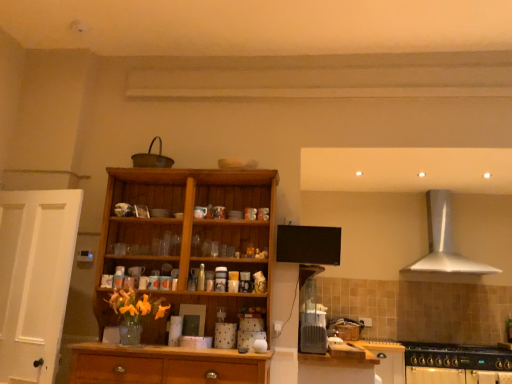
Question: Would you say wooden cabinet at center is outside wooden cabinet at lower center, positioned as the 1th cabinetry in front-to-back order?

Choices:
 (A) no
 (B) yes

Answer: (B)

Question: Considering the relative sizes of wooden cabinet at center and wooden cabinet at lower center, the 2th cabinetry from the back, in the image provided, is wooden cabinet at center smaller than wooden cabinet at lower center, the 2th cabinetry from the back,?

Choices:
 (A) yes
 (B) no

Answer: (B)

Question: Does wooden cabinet at center contain wooden cabinet at lower center, the 2th cabinetry from the back?

Choices:
 (A) no
 (B) yes

Answer: (A)

Question: Can you confirm if wooden cabinet at center is taller than wooden cabinet at lower center, the 1th cabinetry when ordered from left to right?

Choices:
 (A) yes
 (B) no

Answer: (A)

Question: From a real-world perspective, is wooden cabinet at center on top of wooden cabinet at lower center, the 1th cabinetry when ordered from left to right?

Choices:
 (A) yes
 (B) no

Answer: (A)

Question: Does wooden cabinet at center have a greater width compared to wooden cabinet at lower center, the 2th cabinetry from the back?

Choices:
 (A) yes
 (B) no

Answer: (B)

Question: Is black matte gas stove at lower right far away from wooden cabinet at lower center, the 2th cabinetry from the back?

Choices:
 (A) no
 (B) yes

Answer: (B)

Question: Is black matte gas stove at lower right closer to the viewer compared to wooden cabinet at lower center, the 1th cabinetry when ordered from left to right?

Choices:
 (A) yes
 (B) no

Answer: (B)

Question: Can you confirm if black matte gas stove at lower right is smaller than wooden cabinet at lower center, which is the second cabinetry from right to left?

Choices:
 (A) no
 (B) yes

Answer: (A)

Question: From a real-world perspective, is black matte gas stove at lower right positioned under wooden cabinet at lower center, the 1th cabinetry when ordered from left to right, based on gravity?

Choices:
 (A) yes
 (B) no

Answer: (B)

Question: Is black matte gas stove at lower right located outside wooden cabinet at lower center, which is the second cabinetry from right to left?

Choices:
 (A) no
 (B) yes

Answer: (B)

Question: Can you confirm if black matte gas stove at lower right is wider than wooden cabinet at lower center, positioned as the 1th cabinetry in front-to-back order?

Choices:
 (A) no
 (B) yes

Answer: (A)

Question: From a real-world perspective, is wooden cabinet at lower center, the 1th cabinetry when ordered from left to right, on top of silver metallic range hood at upper right?

Choices:
 (A) yes
 (B) no

Answer: (B)